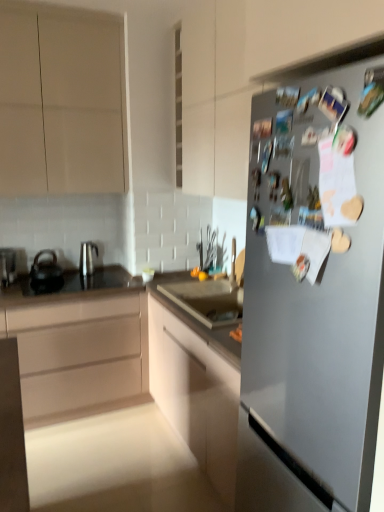
Question: Is black glass countertop at center wider or thinner than metallic silver kettle at left?

Choices:
 (A) thin
 (B) wide

Answer: (B)

Question: Visually, is black glass countertop at center positioned to the left or to the right of metallic silver kettle at left?

Choices:
 (A) right
 (B) left

Answer: (A)

Question: Which of these objects is positioned closest to the black glass countertop at center?

Choices:
 (A) satin silver fridge at right
 (B) satin silver kettle at left, which is counted as the 1th tea pot, starting from the right
 (C) matte beige cabinet at left, marked as the 2th cabinetry in a top-to-bottom arrangement
 (D) matte white cabinet at center, the third cabinetry positioned from the top
 (E) black matte tea pot at left, acting as the first tea pot starting from the left

Answer: (E)

Question: Which object is positioned closest to the satin silver kettle at left, which is counted as the 1th tea pot, starting from the right?

Choices:
 (A) metallic silver kettle at left
 (B) matte beige cabinet at upper left, which is the 3th cabinetry from bottom to top
 (C) matte beige cabinet at left, placed as the second cabinetry when sorted from bottom to top
 (D) satin silver fridge at right
 (E) matte white cabinet at center, the third cabinetry positioned from the top

Answer: (A)